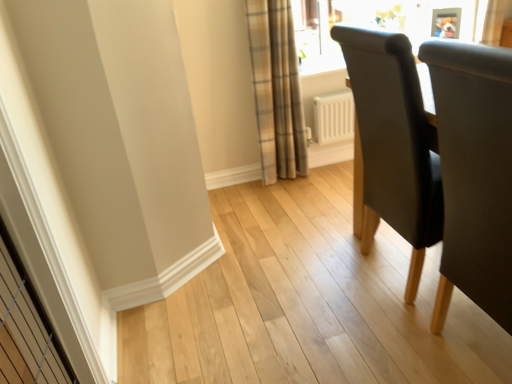
Question: Is point (507, 175) positioned closer to the camera than point (282, 105)?

Choices:
 (A) closer
 (B) farther

Answer: (A)

Question: Is black leather chair at right, positioned as the second chair in back-to-front order, inside or outside of plaid fabric curtain at upper center?

Choices:
 (A) inside
 (B) outside

Answer: (B)

Question: Considering the real-world distances, which object is closest to the black leather chair at right, placed as the 1th chair when sorted from front to back?

Choices:
 (A) plaid fabric curtain at upper center
 (B) dark gray fabric chair at right, the 2th chair viewed from the front

Answer: (B)

Question: Which of these objects is positioned closest to the plaid fabric curtain at upper center?

Choices:
 (A) black leather chair at right, positioned as the second chair in back-to-front order
 (B) dark gray fabric chair at right, the 2th chair viewed from the front

Answer: (B)